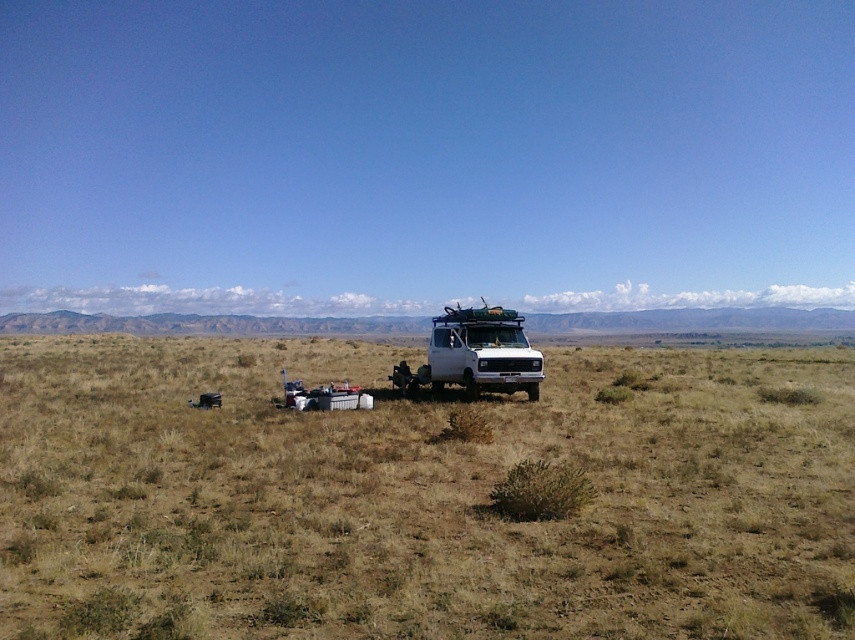
Based on the photo, you are planning to set up a campsite in the area shown in the image. You need to choose between placing your tent on the brown dry grass at center or the white matte van at center. Which location would provide more space for your tent?

The brown dry grass at center is bigger than the white matte van at center, so placing your tent on the brown dry grass at center would provide more space for your tent.

You are a hiker planning to set up a campsite. You have a tent that requires a minimum of 30 feet of space between the tent and any vehicle for safety reasons. Given the scene described, can you safely place your tent in the brown dry grass at center while keeping the white matte van at center at a safe distance?

The distance between the brown dry grass at center and the white matte van at center is 32.67 feet, which exceeds the required 30 feet. Therefore, you can safely place your tent in the brown dry grass at center while maintaining the necessary distance from the white matte van at center.